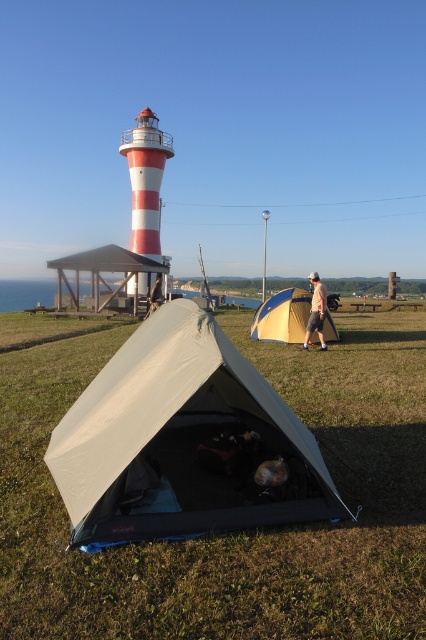
Is pink fabric tent at center smaller than light brown leather jacket at center?

Actually, pink fabric tent at center might be larger than light brown leather jacket at center.

Which is more to the left, pink fabric tent at center or light brown leather jacket at center?

light brown leather jacket at center is more to the left.

Is point (316, 308) farther from viewer compared to point (154, 296)?

No, (316, 308) is in front of (154, 296).

You are a GUI agent. You are given a task and a screenshot of the screen. Output one action in this format:
    pyautogui.click(x=<x>, y=<y>)
    Task: Click on the pink fabric tent at center
    Image resolution: width=426 pixels, height=640 pixels.
    Given the screenshot: What is the action you would take?
    pyautogui.click(x=316, y=310)

Based on the photo, can you confirm if matte gray tent at center is positioned above white plastic tent at center?

No.

Between matte gray tent at center and white plastic tent at center, which one has more height?

Standing taller between the two is white plastic tent at center.

The height and width of the screenshot is (640, 426). What do you see at coordinates (180, 438) in the screenshot? I see `matte gray tent at center` at bounding box center [180, 438].

The image size is (426, 640). In order to click on matte gray tent at center in this screenshot , I will do 180,438.

Between white plastic tent at center and yellow fabric tent at center, which one is positioned lower?

yellow fabric tent at center is lower down.

Does white plastic tent at center appear under yellow fabric tent at center?

Actually, white plastic tent at center is above yellow fabric tent at center.

Where is `white plastic tent at center`? The height and width of the screenshot is (640, 426). white plastic tent at center is located at coordinates (106, 269).